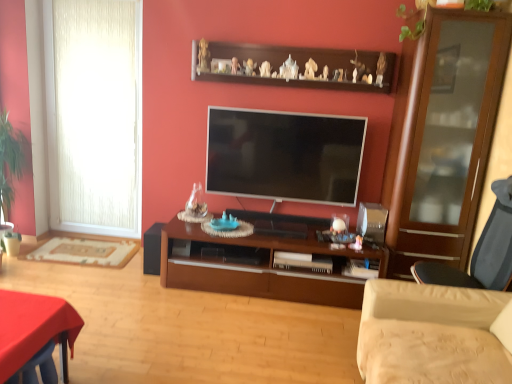
Question: Is green leafy plant at upper right, the second plant viewed from the left, situated inside flat screen tv at center or outside?

Choices:
 (A) inside
 (B) outside

Answer: (B)

Question: In the image, is green leafy plant at upper right, the second plant viewed from the left, on the left side or the right side of flat screen tv at center?

Choices:
 (A) right
 (B) left

Answer: (A)

Question: Estimate the real-world distances between objects in this image. Which object is farther from the dark gray fabric chair at right?

Choices:
 (A) flat screen tv at center
 (B) brown wood cabinet at center
 (C) white textured curtain at left
 (D) green leafy plant at left, which appears as the second plant when viewed from the right
 (E) brown wooden shelf at upper center

Answer: (D)

Question: Which of these objects is positioned farthest from the brown wood cabinet at center?

Choices:
 (A) white textured curtain at left
 (B) green leafy plant at left, arranged as the first plant when ordered from the bottom
 (C) green leafy plant at upper right, placed as the first plant when sorted from right to left
 (D) dark gray fabric chair at right
 (E) brown wooden shelf at upper center

Answer: (B)